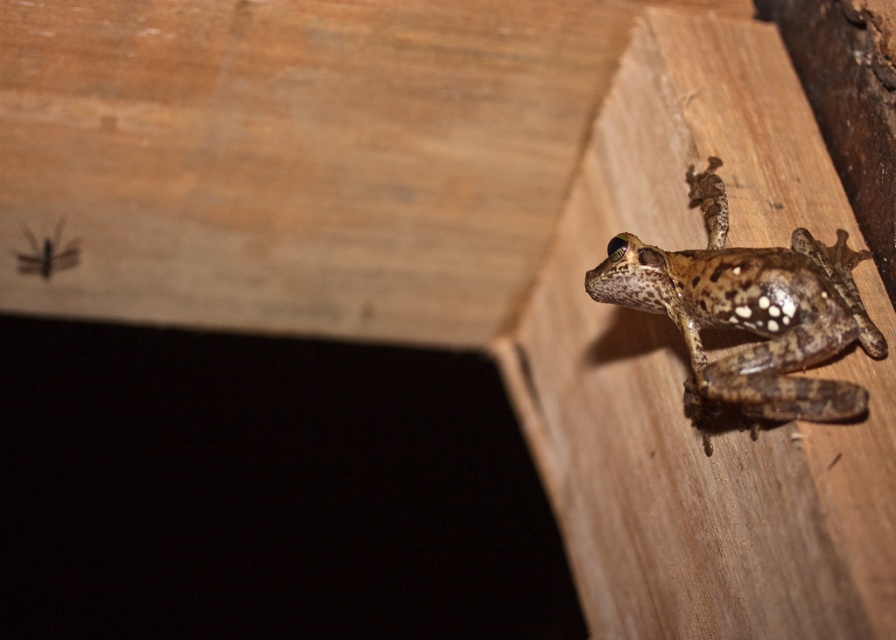
Consider the image. Between speckled brown skin at upper right and brown fuzzy insect at upper left, which one is positioned higher?

brown fuzzy insect at upper left

The image size is (896, 640). Describe the element at coordinates (748, 314) in the screenshot. I see `speckled brown skin at upper right` at that location.

Is point (746, 262) more distant than point (33, 252)?

No.

The width and height of the screenshot is (896, 640). What are the coordinates of `speckled brown skin at upper right` in the screenshot? It's located at (748, 314).

Does brown wood plank at upper right appear under speckled brown skin at upper right?

Yes, brown wood plank at upper right is below speckled brown skin at upper right.

Who is positioned more to the right, brown wood plank at upper right or speckled brown skin at upper right?

Positioned to the right is speckled brown skin at upper right.

What do you see at coordinates (687, 368) in the screenshot? This screenshot has height=640, width=896. I see `brown wood plank at upper right` at bounding box center [687, 368].

The width and height of the screenshot is (896, 640). In order to click on brown wood plank at upper right in this screenshot , I will do `click(687, 368)`.

Does brown wood plank at upper right have a greater height compared to brown fuzzy insect at upper left?

Yes, brown wood plank at upper right is taller than brown fuzzy insect at upper left.

Is brown wood plank at upper right behind brown fuzzy insect at upper left?

No, it is in front of brown fuzzy insect at upper left.

Is point (602, 317) less distant than point (62, 266)?

That is True.

Identify the location of brown wood plank at upper right. The height and width of the screenshot is (640, 896). point(687,368).